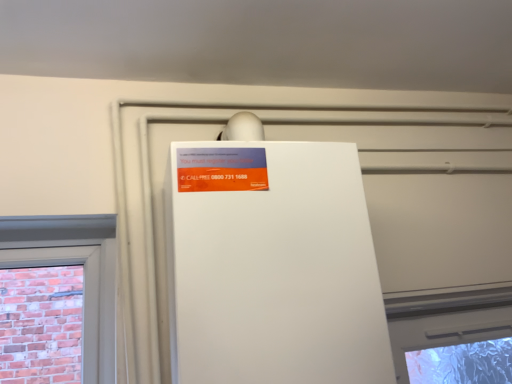
Where is `orange matte sign at upper center`? orange matte sign at upper center is located at coordinates (221, 169).

The width and height of the screenshot is (512, 384). Describe the element at coordinates (221, 169) in the screenshot. I see `orange matte sign at upper center` at that location.

Where is `white matte refrigerator at center`? white matte refrigerator at center is located at coordinates (272, 265).

Describe the element at coordinates (272, 265) in the screenshot. This screenshot has height=384, width=512. I see `white matte refrigerator at center` at that location.

Identify the location of orange matte sign at upper center. The height and width of the screenshot is (384, 512). (221, 169).

Is white matte refrigerator at center to the left of orange matte sign at upper center from the viewer's perspective?

In fact, white matte refrigerator at center is to the right of orange matte sign at upper center.

Considering their positions, is white matte refrigerator at center located in front of or behind orange matte sign at upper center?

white matte refrigerator at center is positioned closer to the viewer than orange matte sign at upper center.

Is point (236, 154) behind point (263, 182)?

Yes, it is behind point (263, 182).

From the image's perspective, which is above, white matte refrigerator at center or orange matte sign at upper center?

orange matte sign at upper center, from the image's perspective.

From a real-world perspective, which object rests below the other?

From a 3D spatial view, white matte refrigerator at center is below.

In the scene shown: Considering the sizes of white matte refrigerator at center and orange matte sign at upper center in the image, is white matte refrigerator at center wider or thinner than orange matte sign at upper center?

Considering their sizes, white matte refrigerator at center looks broader than orange matte sign at upper center.

Considering the sizes of objects white matte refrigerator at center and orange matte sign at upper center in the image provided, who is taller, white matte refrigerator at center or orange matte sign at upper center?

white matte refrigerator at center.

From the picture: Considering the relative sizes of white matte refrigerator at center and orange matte sign at upper center in the image provided, is white matte refrigerator at center smaller than orange matte sign at upper center?

No.

Would you say white matte refrigerator at center is inside or outside orange matte sign at upper center?

white matte refrigerator at center is not enclosed by orange matte sign at upper center.

Consider the image. Would you consider white matte refrigerator at center to be distant from orange matte sign at upper center?

No, white matte refrigerator at center is not far from orange matte sign at upper center.

Is white matte refrigerator at center facing towards orange matte sign at upper center?

Yes, white matte refrigerator at center is aimed at orange matte sign at upper center.

Identify the location of appliance below the orange matte sign at upper center (from the image's perspective). (272, 265).

Considering the positions of objects orange matte sign at upper center and white matte refrigerator at center in the image provided, who is more to the right, orange matte sign at upper center or white matte refrigerator at center?

white matte refrigerator at center.

Relative to white matte refrigerator at center, is orange matte sign at upper center in front or behind?

orange matte sign at upper center is positioned farther from the viewer than white matte refrigerator at center.

Does point (206, 158) come farther from viewer compared to point (327, 149)?

No, (206, 158) is closer to viewer.

From the image's perspective, is orange matte sign at upper center positioned above or below white matte refrigerator at center?

From the image's perspective, orange matte sign at upper center appears above white matte refrigerator at center.

From a real-world perspective, is orange matte sign at upper center on top of white matte refrigerator at center?

Yes, from a real-world perspective, orange matte sign at upper center is on top of white matte refrigerator at center.

Can you confirm if orange matte sign at upper center is wider than white matte refrigerator at center?

In fact, orange matte sign at upper center might be narrower than white matte refrigerator at center.

Between orange matte sign at upper center and white matte refrigerator at center, which one has more height?

With more height is white matte refrigerator at center.

Based on their sizes in the image, would you say orange matte sign at upper center is bigger or smaller than white matte refrigerator at center?

Considering their sizes, orange matte sign at upper center takes up less space than white matte refrigerator at center.

Which is correct: orange matte sign at upper center is inside white matte refrigerator at center, or outside of it?

orange matte sign at upper center is contained in white matte refrigerator at center.

Would you say orange matte sign at upper center is a long distance from white matte refrigerator at center?

That's not correct — orange matte sign at upper center is a little close to white matte refrigerator at center.

Is orange matte sign at upper center oriented away from white matte refrigerator at center?

Yes.

How many degrees apart are the facing directions of orange matte sign at upper center and white matte refrigerator at center?

They differ by 1.96 degrees in their facing directions.

Where is `advertisement located behind the white matte refrigerator at center`? The height and width of the screenshot is (384, 512). advertisement located behind the white matte refrigerator at center is located at coordinates (221, 169).

Identify the location of appliance to the right of orange matte sign at upper center. (272, 265).

The image size is (512, 384). I want to click on advertisement above the white matte refrigerator at center (from a real-world perspective), so click(x=221, y=169).